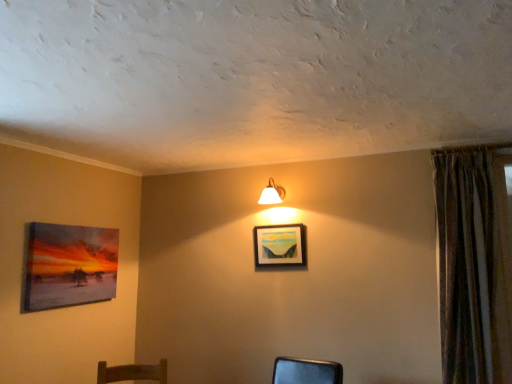
Question: From their relative heights in the image, would you say matte canvas painting at left, positioned as the 1th picture frame in left-to-right order, is taller or shorter than textured brown curtain at right?

Choices:
 (A) tall
 (B) short

Answer: (B)

Question: From the image's perspective, relative to textured brown curtain at right, is matte canvas painting at left, the 2th picture frame viewed from the right, above or below?

Choices:
 (A) below
 (B) above

Answer: (A)

Question: Considering the real-world distances, which object is closest to the matte wooden picture frame at center, which ranks as the first picture frame in right-to-left order?

Choices:
 (A) white glossy wall lamp at upper center
 (B) matte canvas painting at left, the 2th picture frame viewed from the right
 (C) textured brown curtain at right

Answer: (A)

Question: Which of these objects is positioned closest to the matte wooden picture frame at center, which ranks as the first picture frame in right-to-left order?

Choices:
 (A) textured brown curtain at right
 (B) matte canvas painting at left, positioned as the 1th picture frame in left-to-right order
 (C) white glossy wall lamp at upper center

Answer: (C)